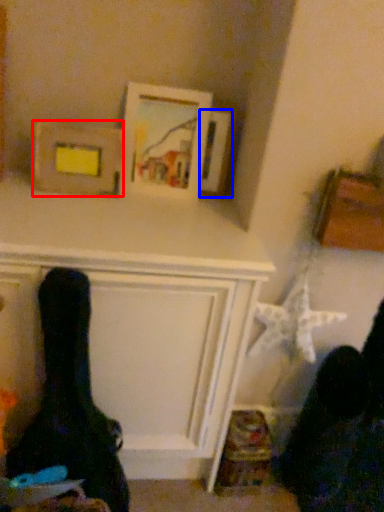
Question: Which of the following is the farthest to the observer, picture frame (highlighted by a red box) or picture frame (highlighted by a blue box)?

Choices:
 (A) picture frame
 (B) picture frame

Answer: (B)